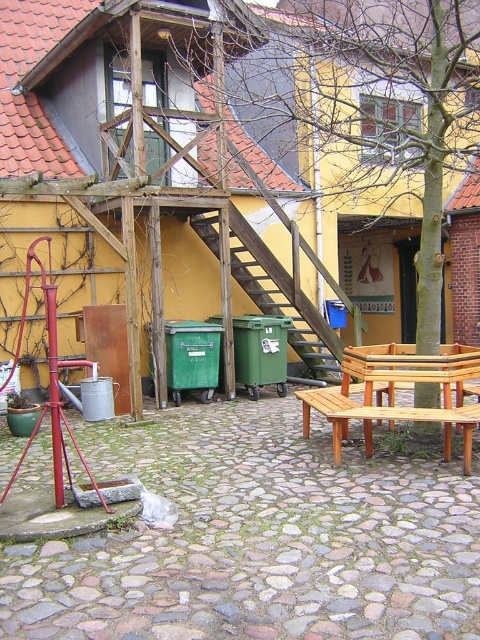
Question: Which object is closer to the camera taking this photo?

Choices:
 (A) light brown wooden picnic table at center
 (B) wooden bench at lower right

Answer: (B)

Question: Is light brown wooden picnic table at center closer to camera compared to wooden bench at lower right?

Choices:
 (A) no
 (B) yes

Answer: (A)

Question: Is light brown wooden picnic table at center to the left of wooden bench at lower right from the viewer's perspective?

Choices:
 (A) no
 (B) yes

Answer: (A)

Question: Is light brown wooden picnic table at center positioned at the back of wooden bench at lower right?

Choices:
 (A) yes
 (B) no

Answer: (A)

Question: Which point is farther to the camera?

Choices:
 (A) (335, 428)
 (B) (414, 374)

Answer: (A)